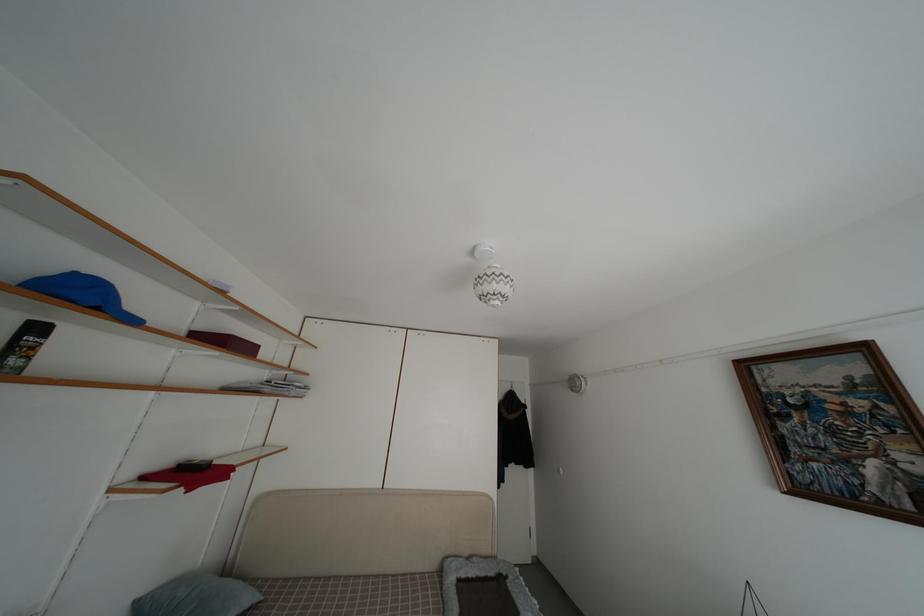
This screenshot has width=924, height=616. What do you see at coordinates (197, 597) in the screenshot?
I see `the blue-grey pillow` at bounding box center [197, 597].